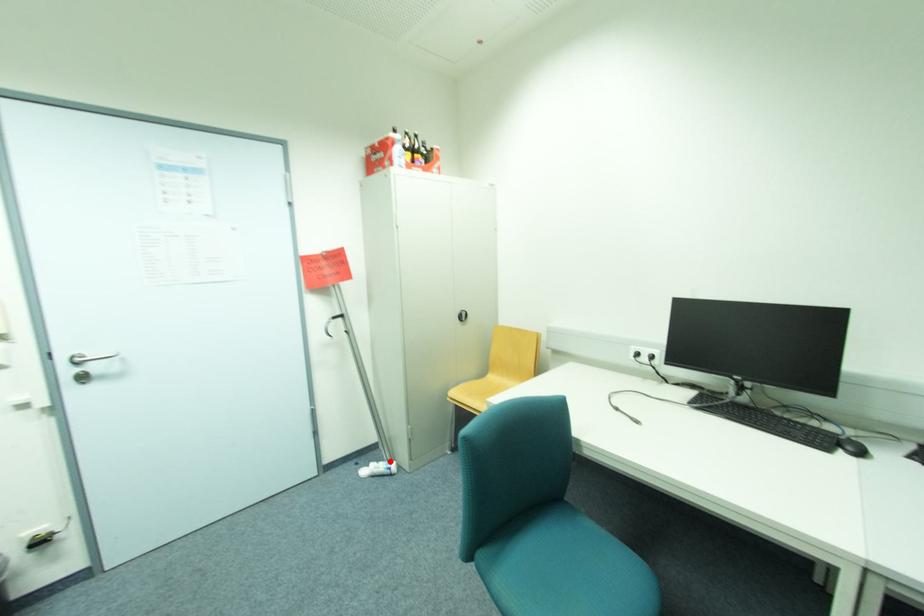
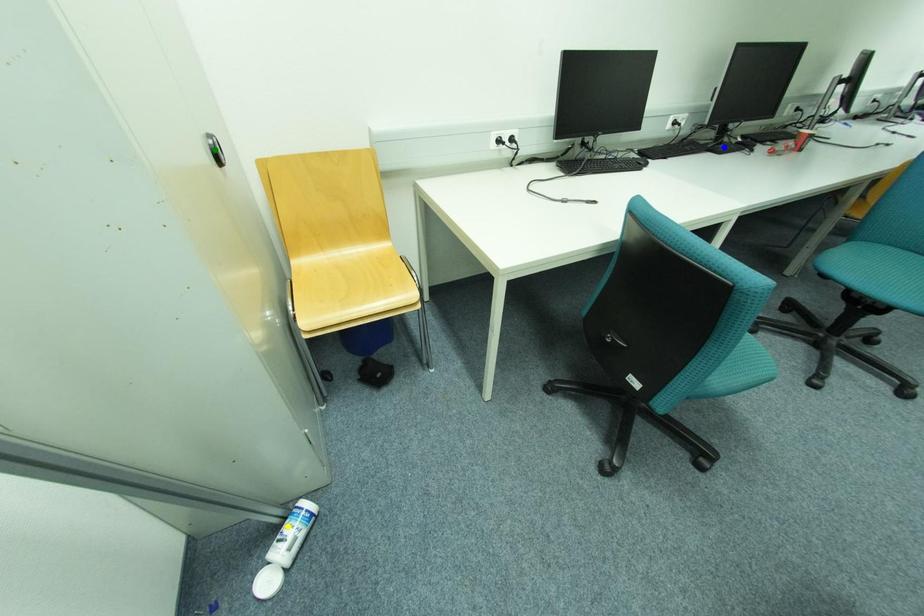
Question: I am providing you with two images of the same scene from different viewpoints. A red point is marked on the first image. You are given multiple points on the second image. Which mark in image 2 goes with the point in image 1?

Choices:
 (A) blue point
 (B) green point
 (C) yellow point

Answer: (C)